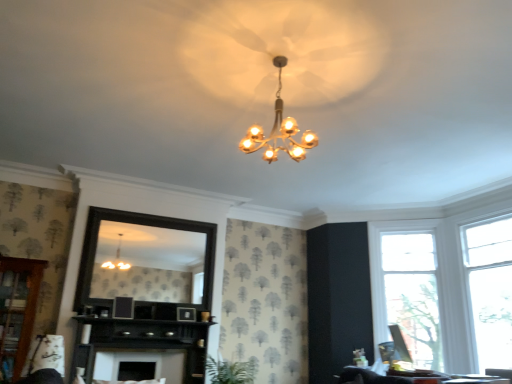
Question: Is black wooden mirror at center to the left of clear glass window at right, which is the 1th window in left-to-right order, from the viewer's perspective?

Choices:
 (A) yes
 (B) no

Answer: (A)

Question: Does black wooden mirror at center have a larger size compared to clear glass window at right, which is the 1th window in left-to-right order?

Choices:
 (A) no
 (B) yes

Answer: (A)

Question: From the image's perspective, is black wooden mirror at center located above clear glass window at right, which is the 1th window in left-to-right order?

Choices:
 (A) no
 (B) yes

Answer: (B)

Question: Considering the relative sizes of black wooden mirror at center and clear glass window at right, which is the 1th window in left-to-right order, in the image provided, is black wooden mirror at center smaller than clear glass window at right, which is the 1th window in left-to-right order,?

Choices:
 (A) yes
 (B) no

Answer: (A)

Question: Can you confirm if black wooden mirror at center is wider than clear glass window at right, which is the 1th window in left-to-right order?

Choices:
 (A) yes
 (B) no

Answer: (B)

Question: Is clear glass window at right, placed as the 2th window when sorted from right to left, bigger or smaller than clear glass window at right, marked as the 1th window in a right-to-left arrangement?

Choices:
 (A) small
 (B) big

Answer: (B)

Question: From the image's perspective, relative to clear glass window at right, marked as the 1th window in a right-to-left arrangement, is clear glass window at right, which is the 1th window in left-to-right order, above or below?

Choices:
 (A) above
 (B) below

Answer: (B)

Question: Is clear glass window at right, which is the 1th window in left-to-right order, in front of or behind clear glass window at right, marked as the 1th window in a right-to-left arrangement, in the image?

Choices:
 (A) front
 (B) behind

Answer: (B)

Question: From a real-world perspective, is clear glass window at right, placed as the 2th window when sorted from right to left, above or below clear glass window at right, positioned as the 2th window in left-to-right order?

Choices:
 (A) above
 (B) below

Answer: (B)

Question: Looking at the image, does green leafy plant at center seem bigger or smaller compared to black wooden mirror at center?

Choices:
 (A) small
 (B) big

Answer: (B)

Question: Is point (246, 382) positioned closer to the camera than point (137, 246)?

Choices:
 (A) farther
 (B) closer

Answer: (B)

Question: In terms of height, does green leafy plant at center look taller or shorter compared to black wooden mirror at center?

Choices:
 (A) short
 (B) tall

Answer: (A)

Question: Considering the positions of green leafy plant at center and black wooden mirror at center in the image, is green leafy plant at center wider or thinner than black wooden mirror at center?

Choices:
 (A) thin
 (B) wide

Answer: (B)

Question: From the image's perspective, relative to black wood fireplace at center, the second dresser in the left-to-right sequence, is white fabric swivel chair at lower left above or below?

Choices:
 (A) below
 (B) above

Answer: (B)

Question: Considering the positions of white fabric swivel chair at lower left and black wood fireplace at center, the 1th dresser positioned from the right, in the image, is white fabric swivel chair at lower left taller or shorter than black wood fireplace at center, the 1th dresser positioned from the right,?

Choices:
 (A) tall
 (B) short

Answer: (B)